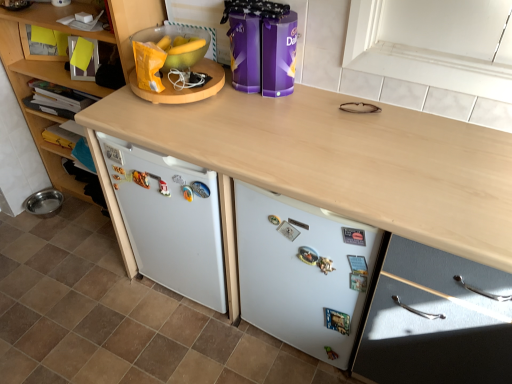
Question: From a real-world perspective, is wooden cabinet at left, the 1th cabinetry in the left-to-right sequence, positioned above or below yellow paper bag at upper left, which appears as the 2th appliance when viewed from the right?

Choices:
 (A) above
 (B) below

Answer: (B)

Question: Do you think wooden cabinet at left, the 1th cabinetry in the left-to-right sequence, is within yellow paper bag at upper left, placed as the 1th appliance when sorted from left to right, or outside of it?

Choices:
 (A) inside
 (B) outside

Answer: (B)

Question: Which is nearer to the light wood/texture drawer at lower right, which is the 1th cabinetry from right to left?

Choices:
 (A) wooden cabinet at left, the 1th cabinetry in the left-to-right sequence
 (B) white glossy tile at lower center
 (C) white matte refrigerator at lower center
 (D) purple glossy chocolate tins at center, arranged as the 2th appliance when viewed from the left
 (E) yellow paper bag at upper left, which appears as the 2th appliance when viewed from the right

Answer: (C)

Question: Estimate the real-world distances between objects in this image. Which object is closer to the purple glossy chocolate tins at center, positioned as the 1th appliance in right-to-left order?

Choices:
 (A) wooden cabinet at left, the 1th cabinetry in the left-to-right sequence
 (B) white matte refrigerator at lower center
 (C) light wood/texture drawer at lower right, which is the 1th cabinetry from right to left
 (D) yellow paper bag at upper left, placed as the 1th appliance when sorted from left to right
 (E) white glossy tile at lower center

Answer: (D)